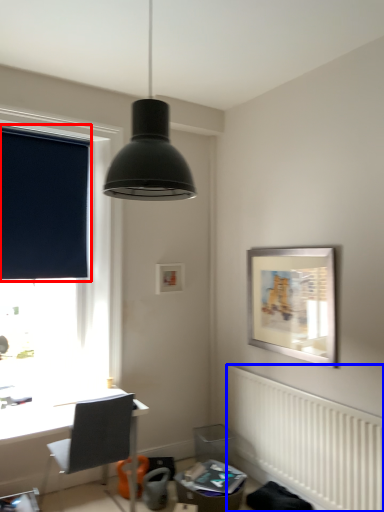
Question: Which object appears farthest to the camera in this image, window screen (highlighted by a red box) or radiator (highlighted by a blue box)?

Choices:
 (A) window screen
 (B) radiator

Answer: (A)